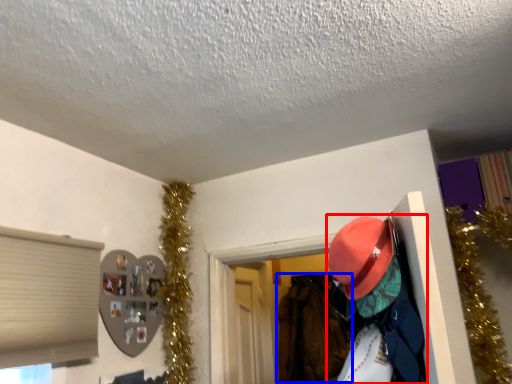
Question: Which of the following is the farthest to the observer, person (highlighted by a red box) or clothing (highlighted by a blue box)?

Choices:
 (A) person
 (B) clothing

Answer: (B)